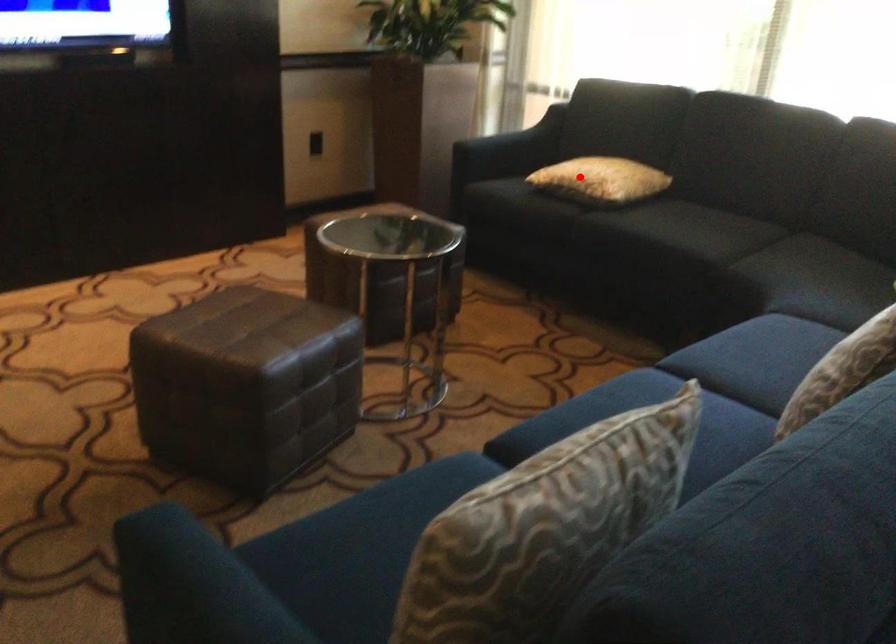
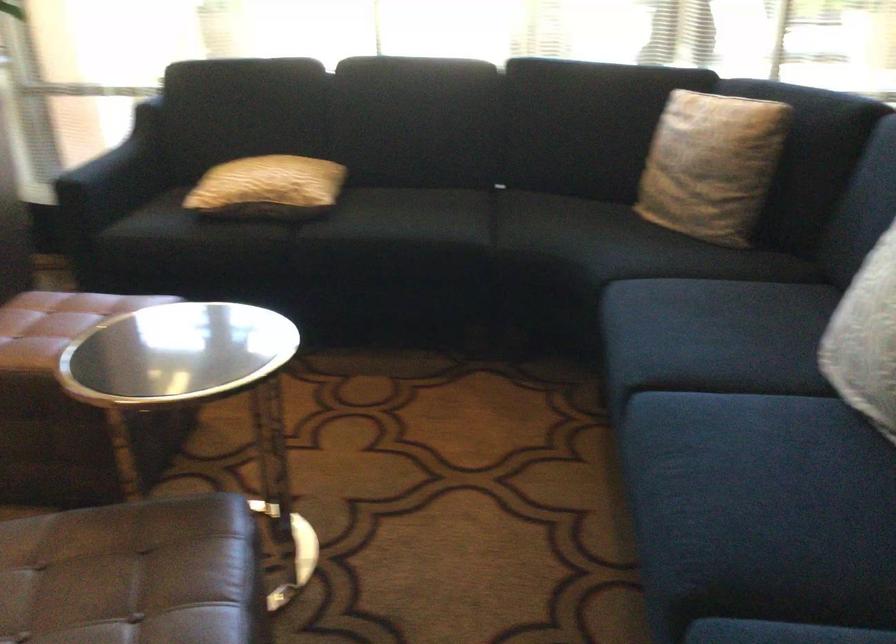
Question: I am providing you with two images of the same scene from different viewpoints. Image1 has a red point marked. In image2, the corresponding 3D location appears at what relative position? Reply with the corresponding letter.

Choices:
 (A) Closer
 (B) Farther

Answer: (A)